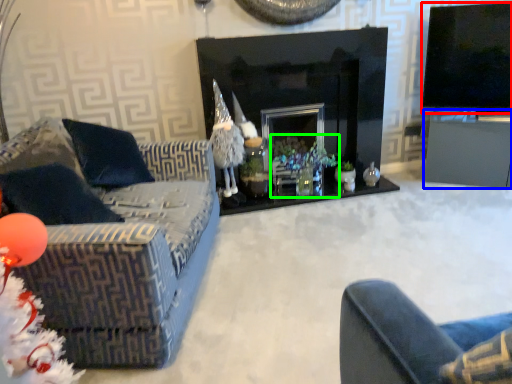
Question: Estimate the real-world distances between objects in this image. Which object is closer to television (highlighted by a red box), table (highlighted by a blue box) or christmas decoration (highlighted by a green box)?

Choices:
 (A) table
 (B) christmas decoration

Answer: (A)